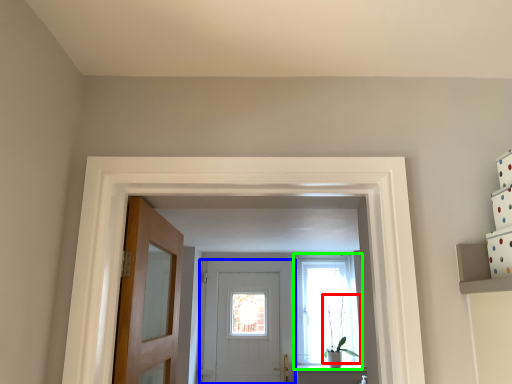
Question: Which object is positioned closest to plant (highlighted by a red box)? Select from door (highlighted by a blue box) and window (highlighted by a green box).

Choices:
 (A) door
 (B) window

Answer: (B)